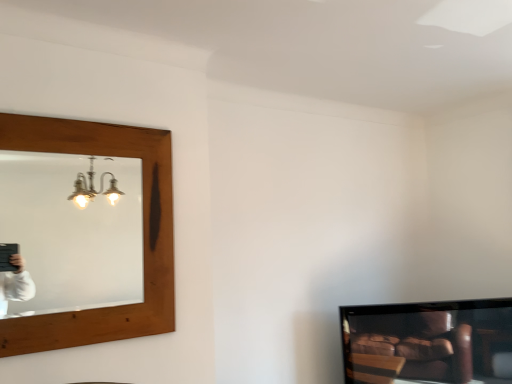
Question: Is matte black television at lower right to the left of wooden mirror at upper left from the viewer's perspective?

Choices:
 (A) yes
 (B) no

Answer: (B)

Question: From the image's perspective, does matte black television at lower right appear higher than wooden mirror at upper left?

Choices:
 (A) no
 (B) yes

Answer: (A)

Question: Could wooden mirror at upper left be considered to be inside matte black television at lower right?

Choices:
 (A) no
 (B) yes

Answer: (A)

Question: Is matte black television at lower right further to camera compared to wooden mirror at upper left?

Choices:
 (A) no
 (B) yes

Answer: (B)

Question: Does matte black television at lower right have a smaller size compared to wooden mirror at upper left?

Choices:
 (A) yes
 (B) no

Answer: (B)

Question: Is the position of matte black television at lower right less distant than that of wooden mirror at upper left?

Choices:
 (A) no
 (B) yes

Answer: (A)

Question: Is wooden mirror at upper left outside matte black television at lower right?

Choices:
 (A) yes
 (B) no

Answer: (A)

Question: From a real-world perspective, is wooden mirror at upper left on matte black television at lower right?

Choices:
 (A) yes
 (B) no

Answer: (A)

Question: Is matte black television at lower right located within wooden mirror at upper left?

Choices:
 (A) no
 (B) yes

Answer: (A)

Question: Considering the relative sizes of wooden mirror at upper left and matte black television at lower right in the image provided, is wooden mirror at upper left thinner than matte black television at lower right?

Choices:
 (A) no
 (B) yes

Answer: (B)

Question: Does wooden mirror at upper left have a lesser height compared to matte black television at lower right?

Choices:
 (A) no
 (B) yes

Answer: (A)

Question: From the image's perspective, is wooden mirror at upper left located beneath matte black television at lower right?

Choices:
 (A) no
 (B) yes

Answer: (A)

Question: From the image's perspective, relative to wooden mirror at upper left, is matte black television at lower right above or below?

Choices:
 (A) below
 (B) above

Answer: (A)